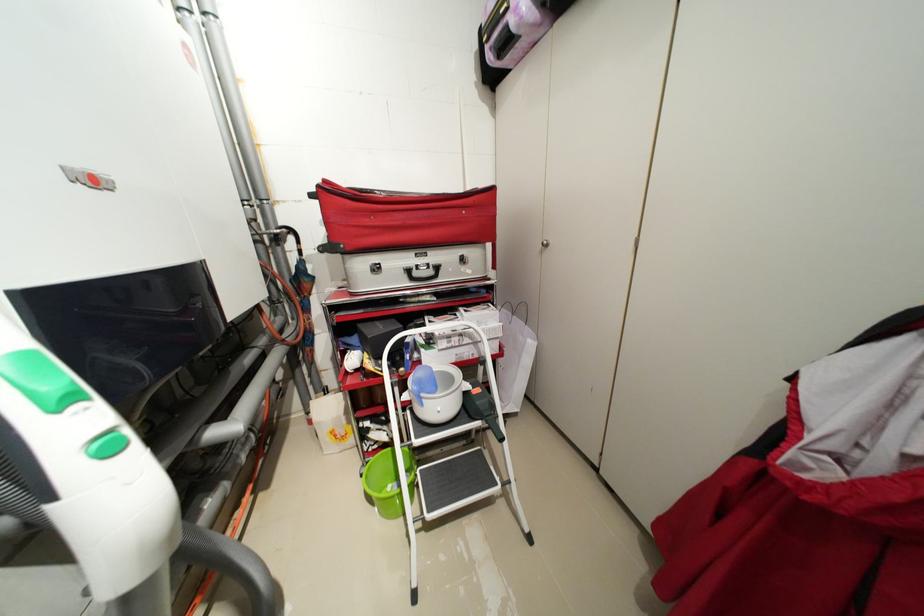
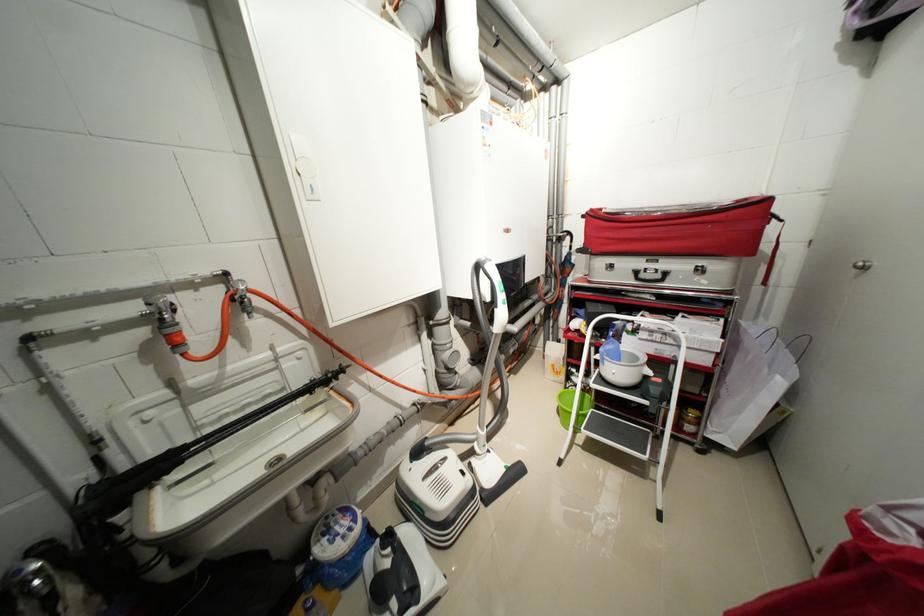
Where in the second image is the point corresponding to pixel 373 479 from the first image?

(566, 397)